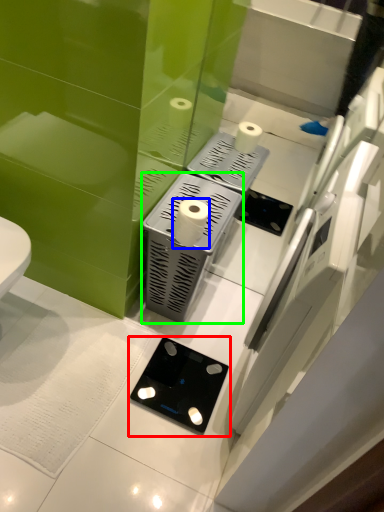
Question: Which object is positioned closest to gadget (highlighted by a red box)? Select from toilet paper (highlighted by a blue box) and appliance (highlighted by a green box).

Choices:
 (A) toilet paper
 (B) appliance

Answer: (B)